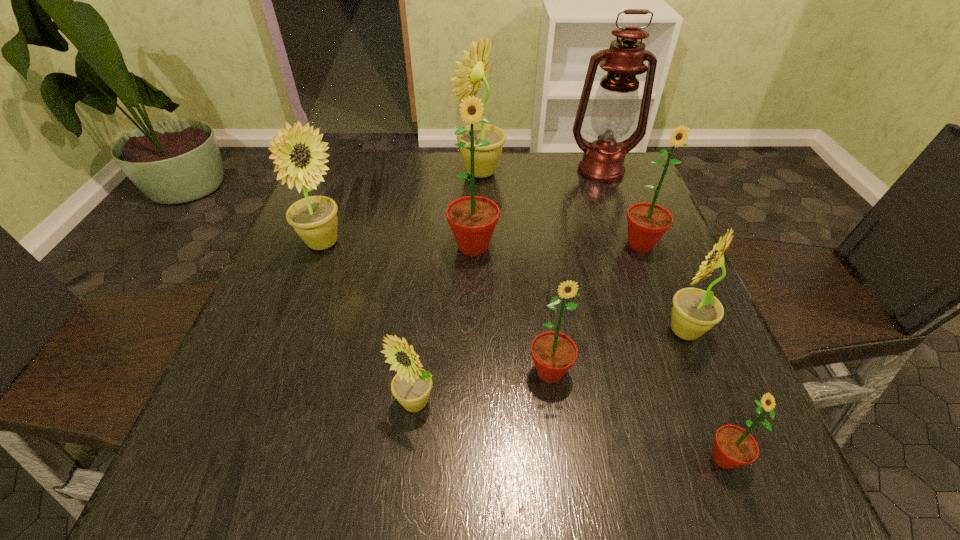
Find the location of a particular element. Image resolution: width=960 pixels, height=540 pixels. object that is the second closest one to the smallest yellow sunflower is located at coordinates (472, 219).

Locate an element on the screen. This screenshot has height=540, width=960. object identified as the closest to the biggest green sunflower is located at coordinates (471, 76).

You are a GUI agent. You are given a task and a screenshot of the screen. Output one action in this format:
    pyautogui.click(x=<x>, y=<y>)
    Task: Click on the sunflower that is the second closest to the second smallest yellow sunflower
    
    Given the screenshot: What is the action you would take?
    pyautogui.click(x=734, y=446)

Identify which sunflower is located as the sixth nearest to the leftmost green sunflower. Please provide its 2D coordinates. Your answer should be formatted as a tuple, i.e. [(x, y)], where the tuple contains the x and y coordinates of a point satisfying the conditions above.

[(695, 311)]

The height and width of the screenshot is (540, 960). I want to click on yellow sunflower that stands as the closest to the third farthest green sunflower, so click(411, 386).

The height and width of the screenshot is (540, 960). In order to click on yellow sunflower that is the second nearest to the red oil lamp in this screenshot , I will do `click(695, 311)`.

Find the location of a particular element. The image size is (960, 540). green sunflower object that ranks as the second closest to the biggest green sunflower is located at coordinates (647, 222).

Identify which green sunflower is the third closest to the oil lamp. Please provide its 2D coordinates. Your answer should be formatted as a tuple, i.e. [(x, y)], where the tuple contains the x and y coordinates of a point satisfying the conditions above.

[(553, 353)]

Locate an element on the screen. The width and height of the screenshot is (960, 540). vacant space that satisfies the following two spatial constraints: 1. on the face of the third smallest green sunflower; 2. on the face of the nearest green sunflower is located at coordinates (725, 458).

You are a GUI agent. You are given a task and a screenshot of the screen. Output one action in this format:
    pyautogui.click(x=<x>, y=<y>)
    Task: Click on the blank space that satisfies the following two spatial constraints: 1. on the front side of the red oil lamp; 2. on the face of the farthest sunflower
    This screenshot has width=960, height=540.
    Given the screenshot: What is the action you would take?
    [601, 172]